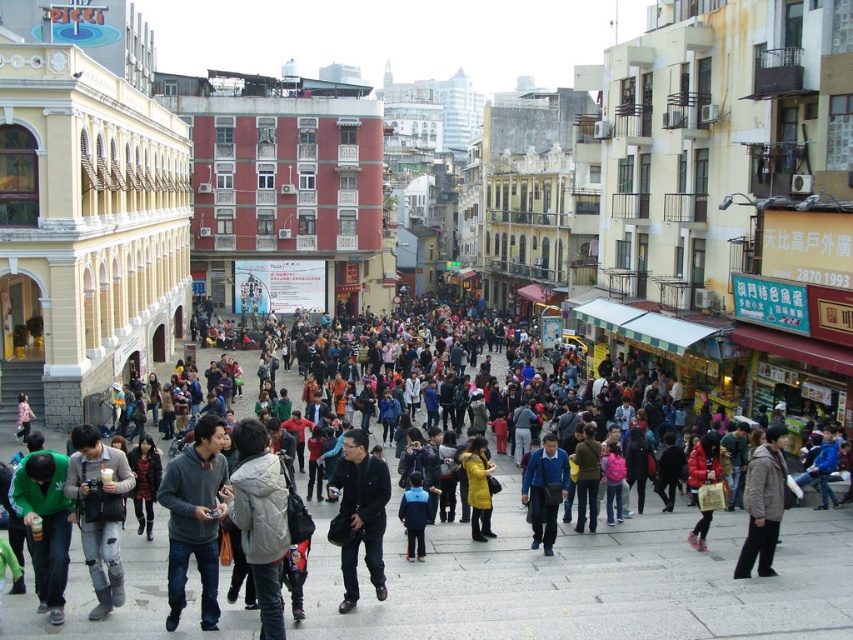
Is point (115, 458) farther from camera compared to point (482, 449)?

No, it is not.

This screenshot has height=640, width=853. What do you see at coordinates (99, 512) in the screenshot?
I see `ripped jeans at lower left` at bounding box center [99, 512].

Locate an element on the screen. The width and height of the screenshot is (853, 640). ripped jeans at lower left is located at coordinates pos(99,512).

Where is `ripped jeans at lower left`? The width and height of the screenshot is (853, 640). ripped jeans at lower left is located at coordinates (99, 512).

Between dark blue jacket at center and blue matte jacket at center, which one has less height?

blue matte jacket at center is shorter.

Does point (354, 528) lie behind point (532, 458)?

No, it is in front of (532, 458).

At what (x,y) coordinates should I click in order to perform the action: click on dark blue jacket at center. Please return your answer as a coordinate pair (x, y). This screenshot has height=640, width=853. Looking at the image, I should click on (358, 515).

Between matte gray building at center and white fuzzy jacket at center, which one is positioned higher?

Positioned higher is matte gray building at center.

Is point (419, 228) behind point (280, 602)?

Yes, it is.

Locate an element on the screen. This screenshot has width=853, height=640. matte gray building at center is located at coordinates (692, 195).